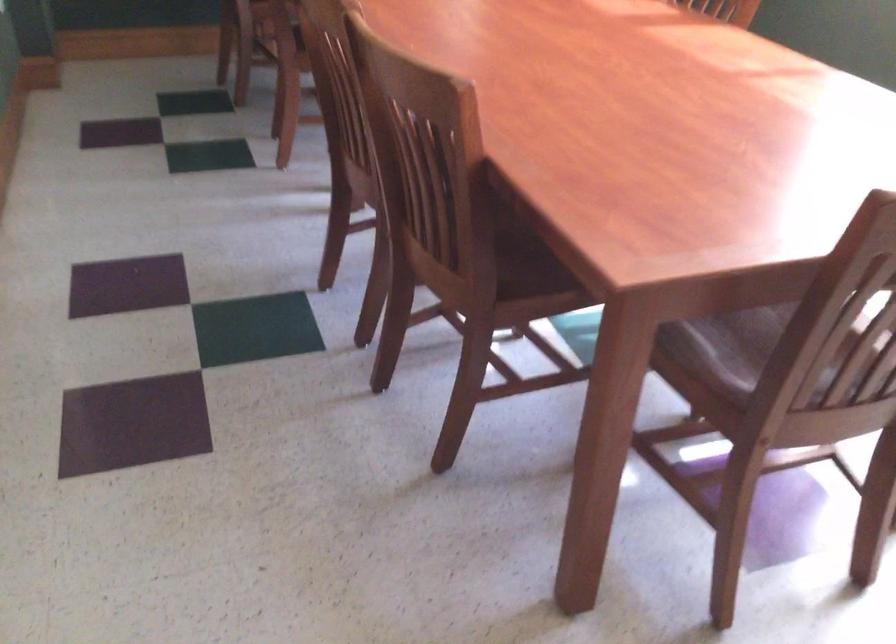
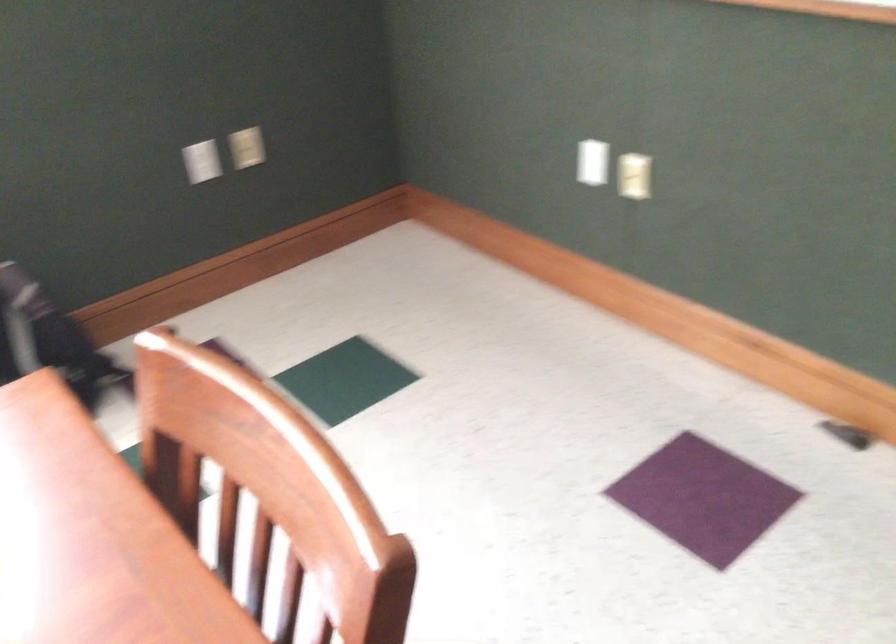
Based on the continuous images, in which direction is the camera rotating?

The camera's rotation is toward right-down.